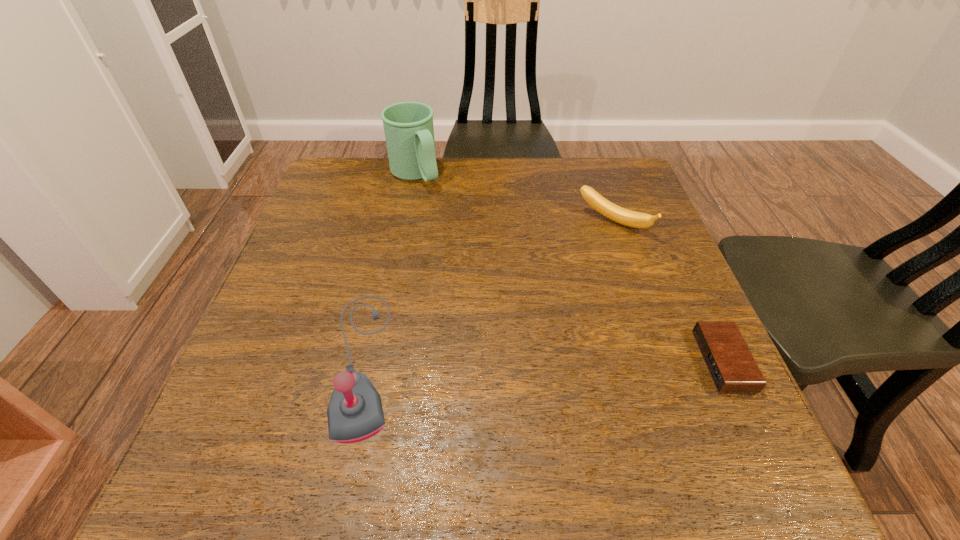
Locate an element on the screen. Image resolution: width=960 pixels, height=540 pixels. free space that satisfies the following two spatial constraints: 1. on the front side of the third nearest object; 2. on the front face of the alarm clock is located at coordinates (660, 361).

Locate an element on the screen. free space that satisfies the following two spatial constraints: 1. on the front side of the farthest object; 2. on the front face of the shortest object is located at coordinates (379, 361).

The height and width of the screenshot is (540, 960). I want to click on vacant position in the image that satisfies the following two spatial constraints: 1. on the front side of the tallest object; 2. on the left side of the second shortest object, so click(x=405, y=223).

Identify the location of vacant space that satisfies the following two spatial constraints: 1. on the back side of the farthest object; 2. on the right side of the joystick. (405, 174).